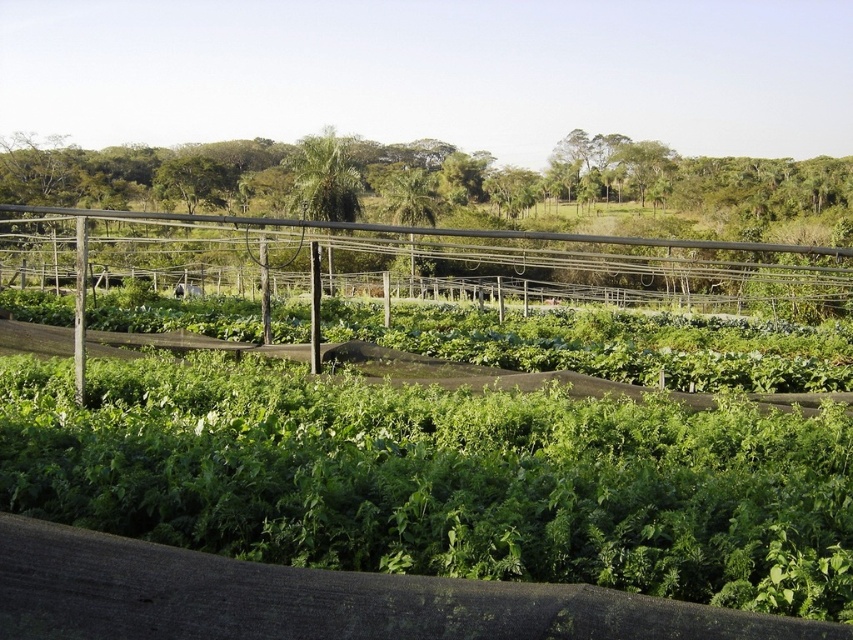
Is point (761, 508) farther from camera compared to point (352, 252)?

That is False.

Locate an element on the screen. green leafy plant at center is located at coordinates (440, 477).

Identify the location of green leafy plant at center. The image size is (853, 640). (440, 477).